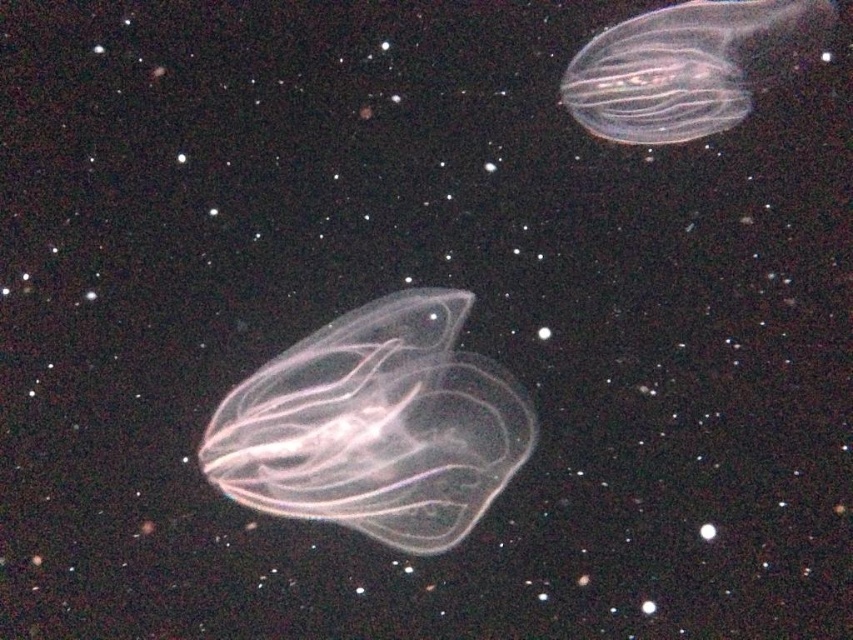
Between point (251, 432) and point (698, 118), which one is positioned behind?

The point (698, 118) is behind.

Can you confirm if transparent gelatinous at center is taller than transparent gelatinous at upper right?

Yes.

Between point (448, 298) and point (596, 67), which one is positioned behind?

The point (448, 298) is behind.

I want to click on transparent gelatinous at center, so click(x=375, y=426).